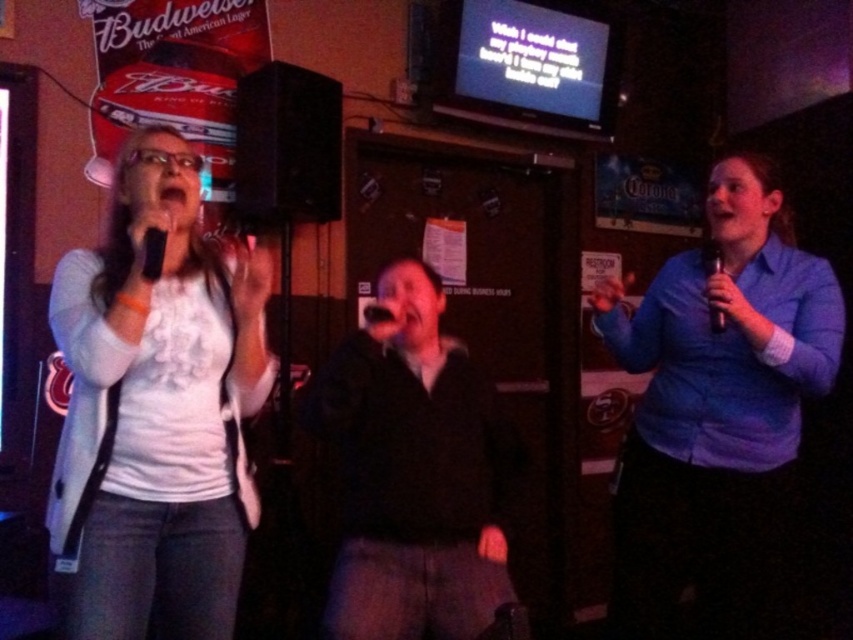
Is black matte microphone at left below black matte microphone at center?

No, black matte microphone at left is not below black matte microphone at center.

Is black matte microphone at left shorter than black matte microphone at center?

In fact, black matte microphone at left may be taller than black matte microphone at center.

Is point (144, 256) behind point (376, 308)?

That is False.

At what (x,y) coordinates should I click in order to perform the action: click on black matte microphone at left. Please return your answer as a coordinate pair (x, y). Looking at the image, I should click on (154, 252).

Does white matte shirt at left come in front of black matte microphone at right?

Yes, white matte shirt at left is in front of black matte microphone at right.

In the scene shown: Who is shorter, white matte shirt at left or black matte microphone at right?

black matte microphone at right

Locate an element on the screen. This screenshot has height=640, width=853. white matte shirt at left is located at coordinates (155, 412).

Between point (785, 465) and point (718, 269), which one is positioned behind?

Positioned behind is point (785, 465).

Can you confirm if blue shirt at right is positioned below black matte microphone at right?

Indeed, blue shirt at right is positioned under black matte microphone at right.

At what (x,y) coordinates should I click in order to perform the action: click on blue shirt at right. Please return your answer as a coordinate pair (x, y). This screenshot has height=640, width=853. Looking at the image, I should click on (718, 416).